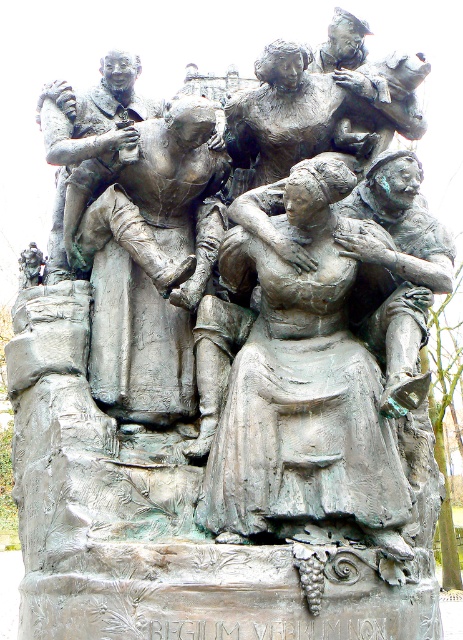
You are an art conservator examining the bronze sculpture. You need to place a protective barrier around the bronze statue of woman at center. To ensure it is centered, where should you position the barrier relative to the statue?

The bronze statue of woman at center is located at point (304, 385), so you should position the barrier around those coordinates to ensure it is centered.

You are standing at the base of the bronze sculpture and want to take a photo of the point at coordinates point (317, 257). If your camera has a maximum zoom range of 100 feet, will you be able to capture the point clearly without moving closer?

The point (317, 257) is 152.36 feet away from the viewer. Since the camera can only zoom up to 100 feet, you will not be able to capture the point clearly without moving closer.

Based on the scene description, which bronze statue is taller between the bronze statue of woman at center and the bronze statue of man at center?

The bronze statue of woman at center is taller than the bronze statue of man at center according to the description.